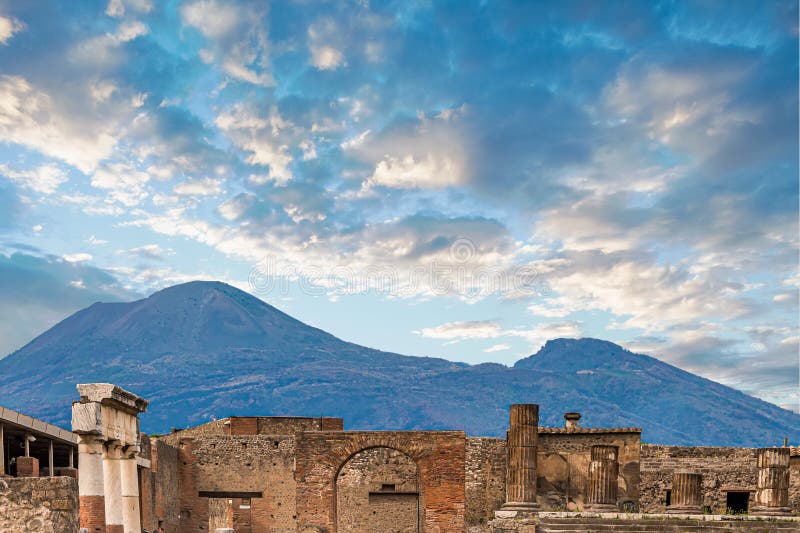
Where is `pillar`? This screenshot has height=533, width=800. pillar is located at coordinates (90, 481).